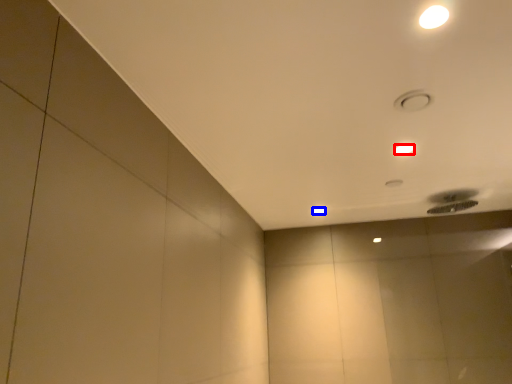
Question: Which point is further to the camera, lamp (highlighted by a red box) or lamp (highlighted by a blue box)?

Choices:
 (A) lamp
 (B) lamp

Answer: (B)